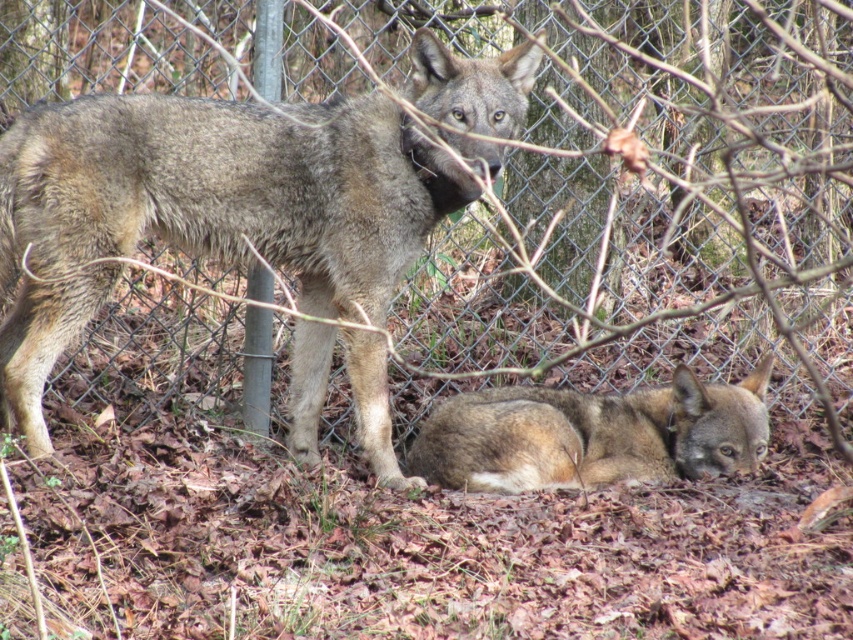
Between gray fur wolf at center and fuzzy brown fur at lower center, which one has less height?

fuzzy brown fur at lower center is shorter.

Who is more forward, (51, 179) or (430, 422)?

Positioned in front is point (51, 179).

Is point (184, 112) in front of point (527, 474)?

Yes.

Find the location of a particular element. The width and height of the screenshot is (853, 640). gray fur wolf at center is located at coordinates (206, 209).